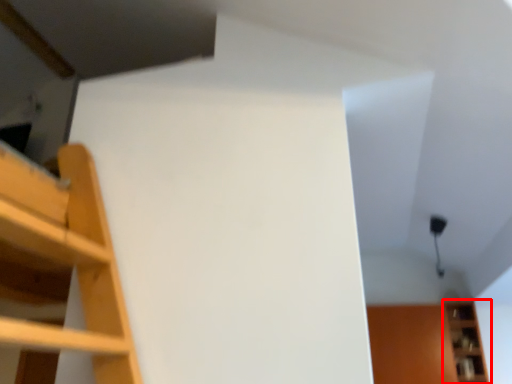
Question: From the image's perspective, considering the relative positions of shelf (annotated by the red box) and cabinet in the image provided, where is shelf (annotated by the red box) located with respect to the staircase?

Choices:
 (A) above
 (B) below

Answer: (A)